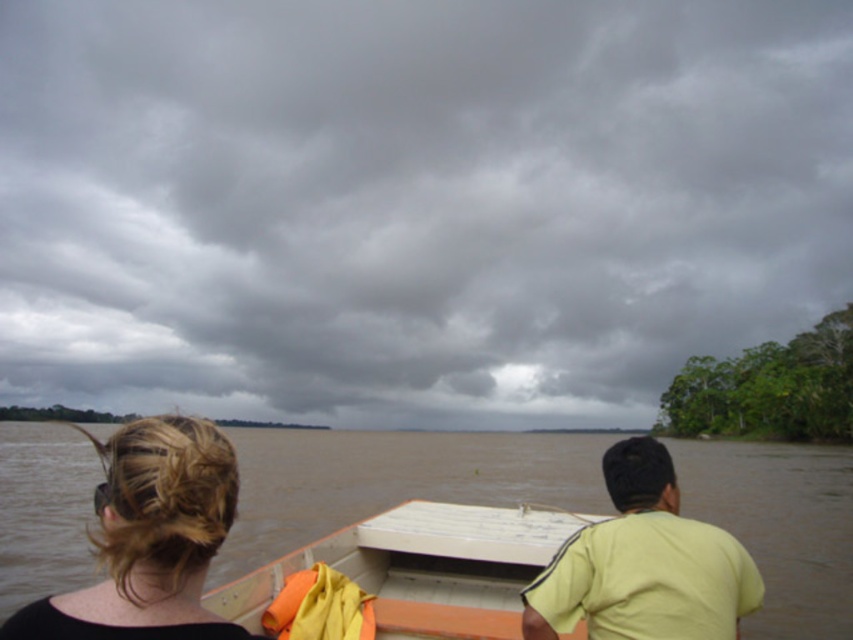
You are on a boat in the middle of a lake. You see a point at coordinates (149, 538). What object is located at that point?

The point at coordinates (149, 538) corresponds to the blonde hair at lower left.

You are navigating a small boat on a river. You see the brown muddy water at center. Based on its position, can you determine if the boat is currently moving towards the shore or away from it?

The brown muddy water at center is located at point (392, 481), which indicates it is in the central area of the scene. Without additional directional cues, it is impossible to determine the boat movement direction towards or away from the shore.